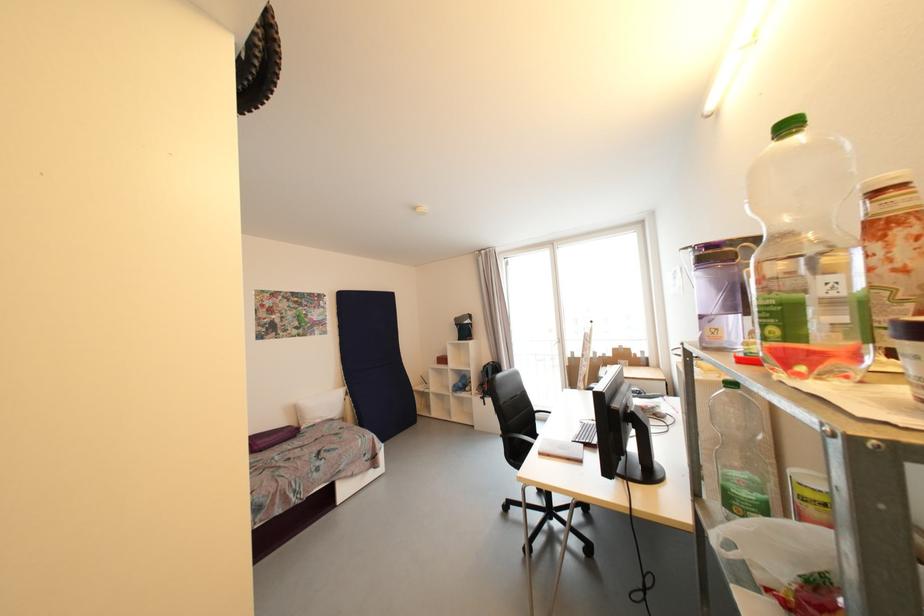
Where is `white plastic bag`? white plastic bag is located at coordinates (776, 549).